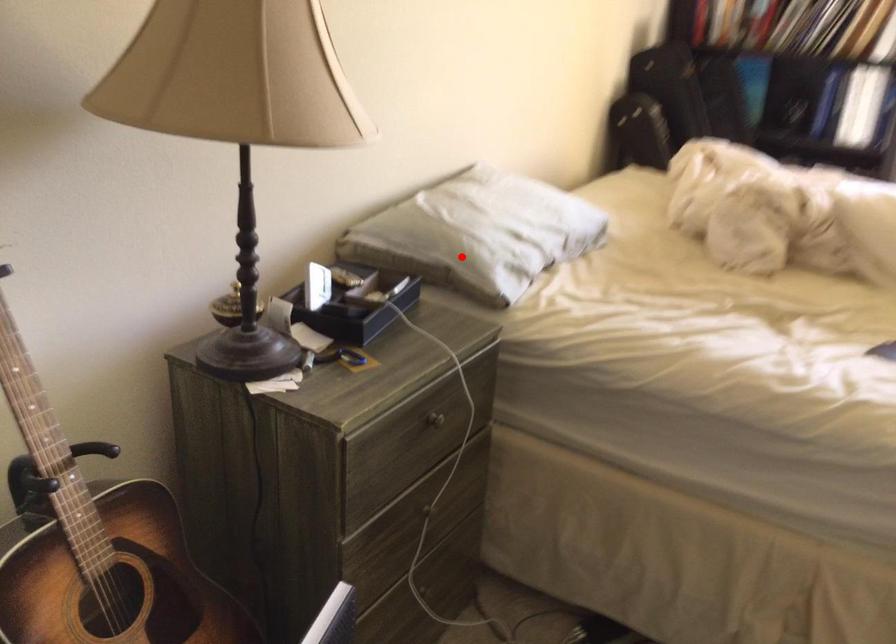
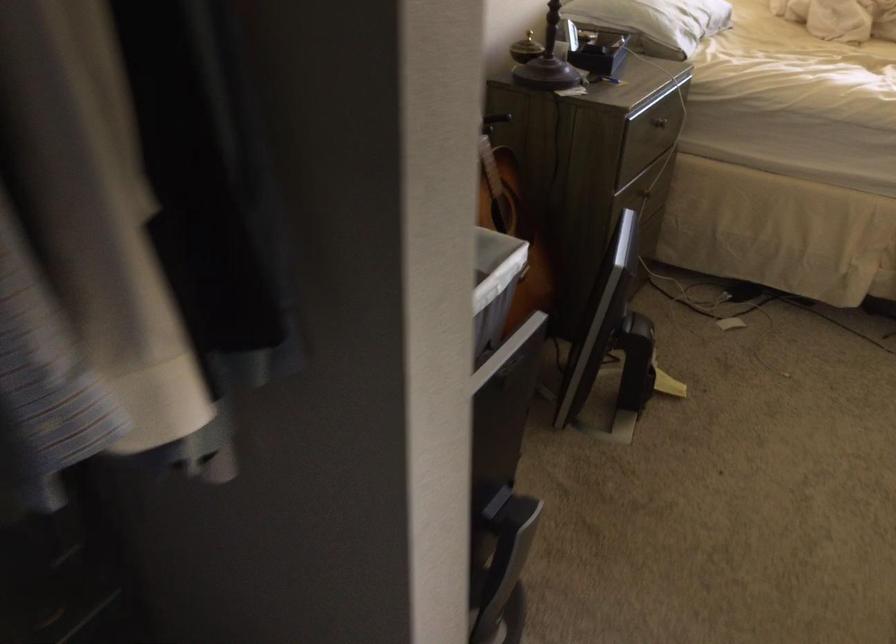
Question: I am providing you with two images of the same scene from different viewpoints. A red point is marked on the first image. Can you still see the location of the red point in image 2?

Choices:
 (A) Yes
 (B) No

Answer: (A)